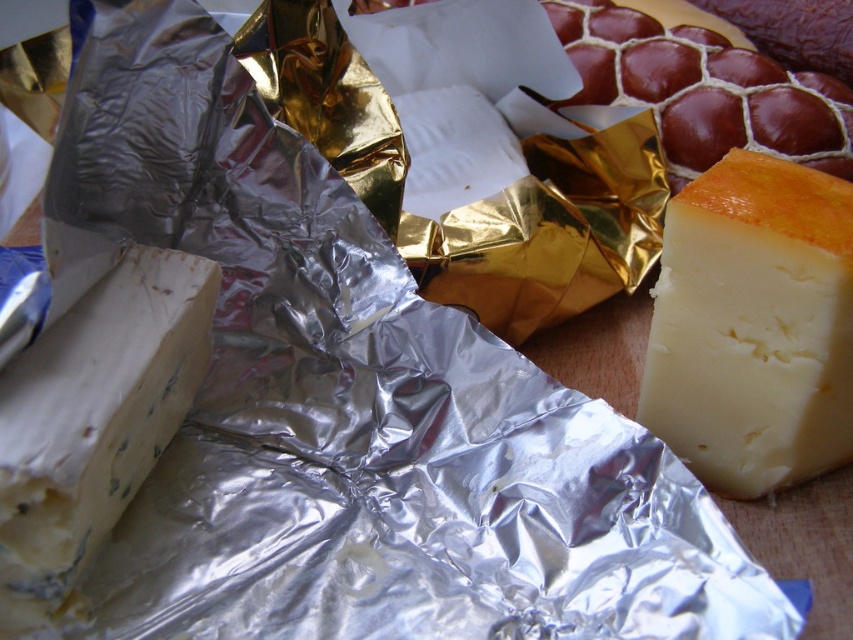
Question: From the image, what is the correct spatial relationship of yellow creamy cheese at right in relation to blue veined cheese at lower left?

Choices:
 (A) below
 (B) above

Answer: (B)

Question: Can you confirm if yellow creamy cheese at right is thinner than blue veined cheese at lower left?

Choices:
 (A) yes
 (B) no

Answer: (B)

Question: Is yellow creamy cheese at right in front of blue veined cheese at lower left?

Choices:
 (A) no
 (B) yes

Answer: (A)